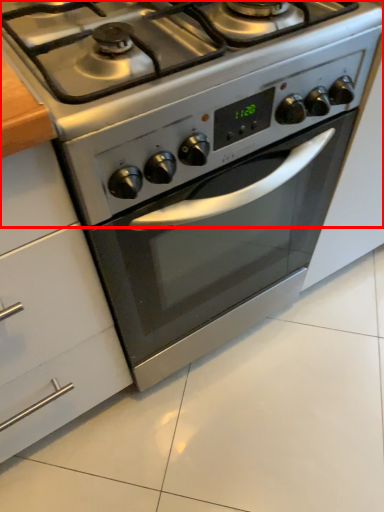
Question: Where is gas stove (annotated by the red box) located in relation to cabinetry in the image?

Choices:
 (A) right
 (B) left

Answer: (A)